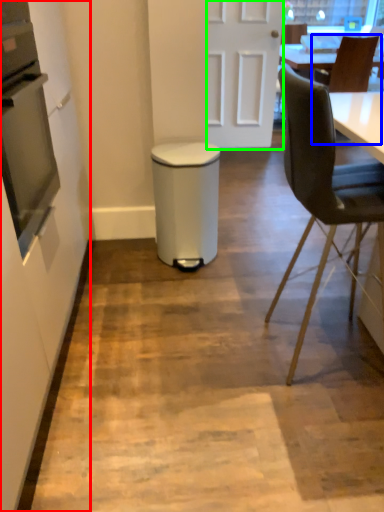
Question: Considering the real-world distances, which object is closest to side (highlighted by a red box)? chair (highlighted by a blue box) or door (highlighted by a green box).

Choices:
 (A) chair
 (B) door

Answer: (B)